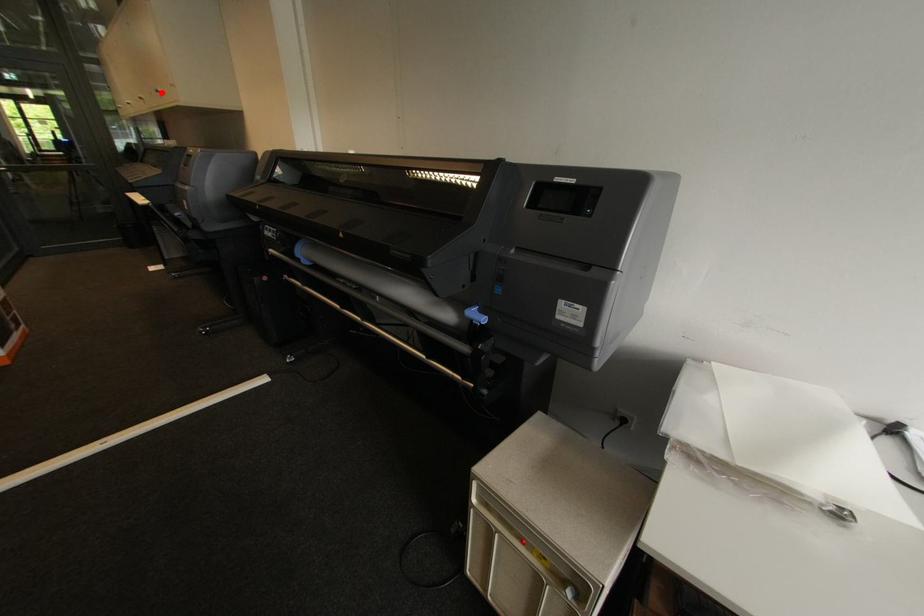
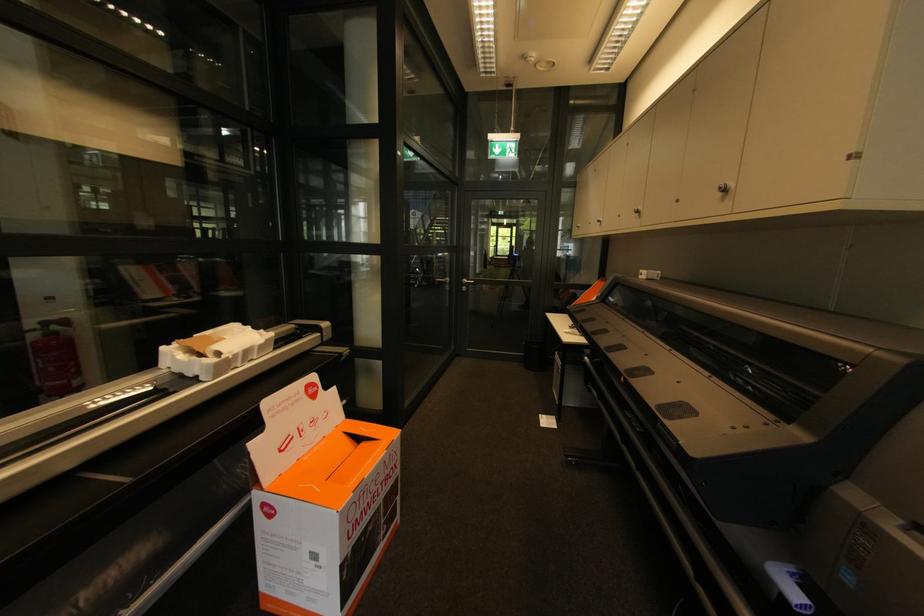
Question: A red point is marked in image1. In image2, is the corresponding 3D point closer to the camera or farther? Reply with the corresponding letter.

Choices:
 (A) The corresponding 3D point is closer.
 (B) The corresponding 3D point is farther.

Answer: (A)